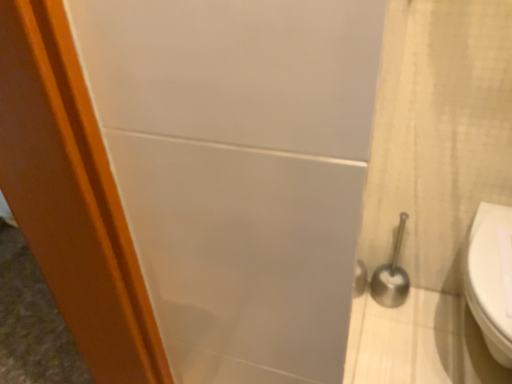
Question: Does white glossy toilet at right have a greater width compared to satin silver toilet brush at right?

Choices:
 (A) yes
 (B) no

Answer: (A)

Question: Does white glossy toilet at right have a smaller size compared to satin silver toilet brush at right?

Choices:
 (A) no
 (B) yes

Answer: (A)

Question: Is white glossy toilet at right not inside satin silver toilet brush at right?

Choices:
 (A) yes
 (B) no

Answer: (A)

Question: Is white glossy toilet at right to the right of satin silver toilet brush at right from the viewer's perspective?

Choices:
 (A) yes
 (B) no

Answer: (A)

Question: From a real-world perspective, does white glossy toilet at right sit lower than satin silver toilet brush at right?

Choices:
 (A) no
 (B) yes

Answer: (A)

Question: From the image's perspective, is white glossy toilet at right above satin silver toilet brush at right?

Choices:
 (A) yes
 (B) no

Answer: (B)

Question: Can you confirm if satin silver toilet brush at right is thinner than white glossy toilet at right?

Choices:
 (A) no
 (B) yes

Answer: (B)

Question: Considering the relative sizes of satin silver toilet brush at right and white glossy toilet at right in the image provided, is satin silver toilet brush at right smaller than white glossy toilet at right?

Choices:
 (A) yes
 (B) no

Answer: (A)

Question: Considering the relative sizes of satin silver toilet brush at right and white glossy toilet at right in the image provided, is satin silver toilet brush at right wider than white glossy toilet at right?

Choices:
 (A) no
 (B) yes

Answer: (A)

Question: Is satin silver toilet brush at right directly adjacent to white glossy toilet at right?

Choices:
 (A) no
 (B) yes

Answer: (A)

Question: From the image's perspective, would you say satin silver toilet brush at right is positioned over white glossy toilet at right?

Choices:
 (A) yes
 (B) no

Answer: (A)

Question: From a real-world perspective, is satin silver toilet brush at right positioned under white glossy toilet at right based on gravity?

Choices:
 (A) yes
 (B) no

Answer: (A)

Question: Is white glossy toilet at right spatially inside satin silver toilet brush at right, or outside of it?

Choices:
 (A) outside
 (B) inside

Answer: (A)